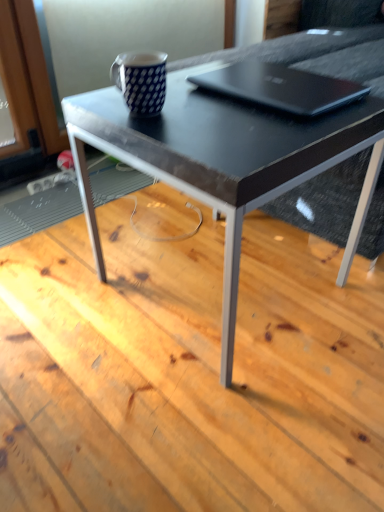
The width and height of the screenshot is (384, 512). What are the coordinates of `empty space that is ontop of black glossy table at center (from a real-world perspective)` in the screenshot? It's located at (226, 100).